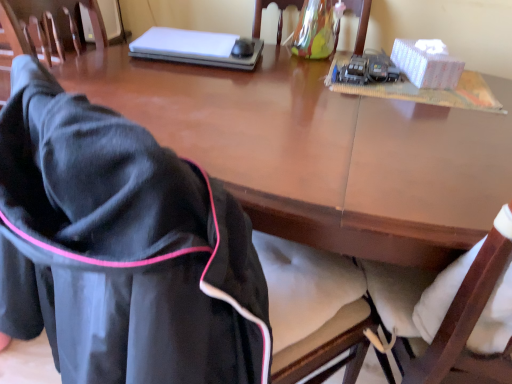
What are the coordinates of `free spot in front of white cardboard box at upper right` in the screenshot? It's located at (442, 107).